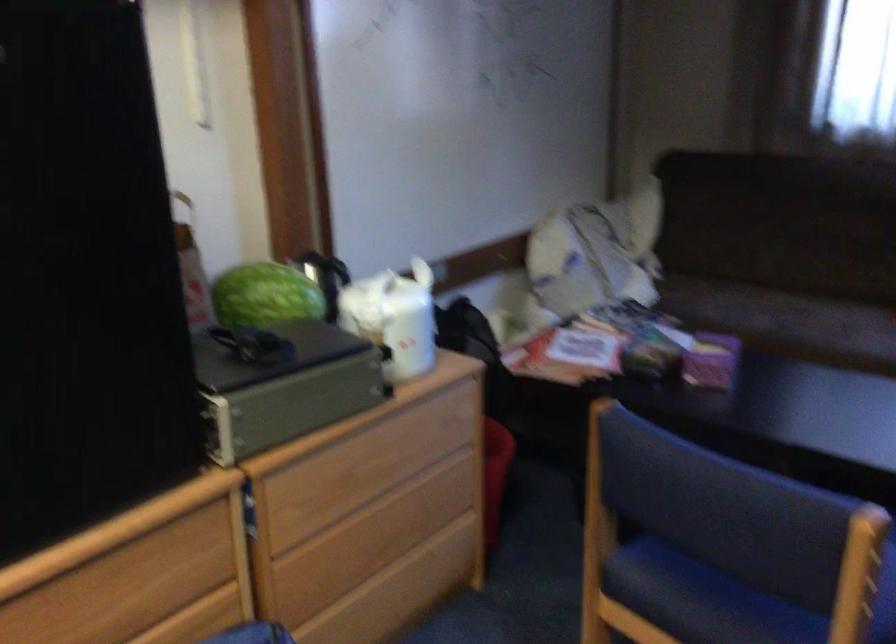
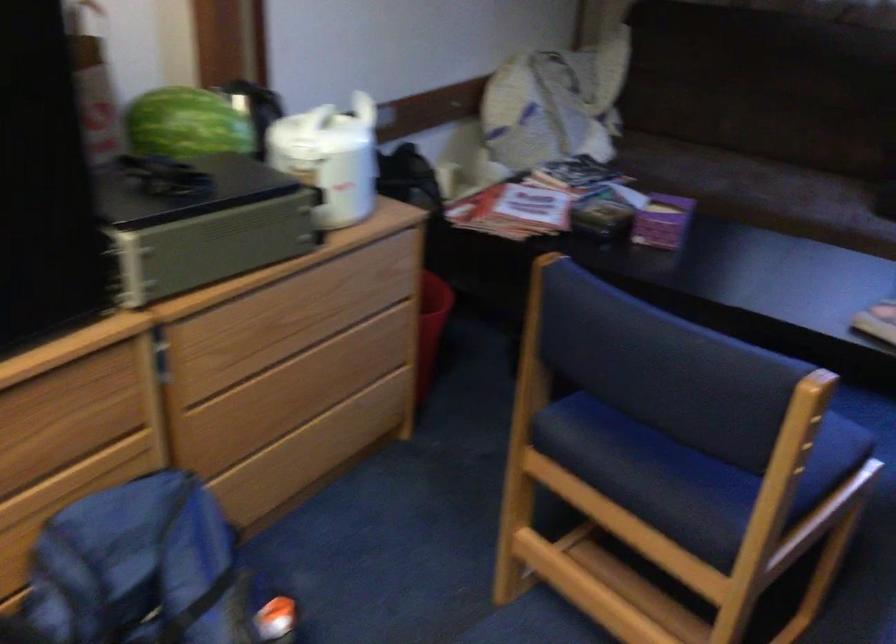
Question: The images are taken continuously from a first-person perspective. In which direction is your viewpoint rotating?

Choices:
 (A) Left
 (B) Right
 (C) Up
 (D) Down

Answer: (D)